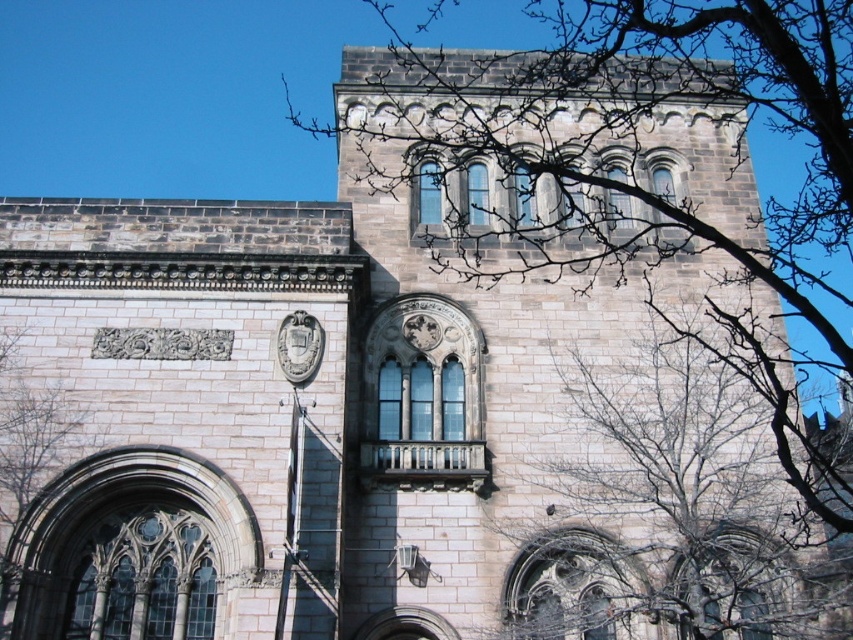
Measure the distance between bare branches at center and camera.

The distance of bare branches at center from camera is 29.05 meters.

Can you confirm if bare branches at center is thinner than bare branches at left?

In fact, bare branches at center might be wider than bare branches at left.

Is point (633, 435) more distant than point (3, 326)?

Yes, it is.

Where is `bare branches at center`? bare branches at center is located at coordinates (669, 508).